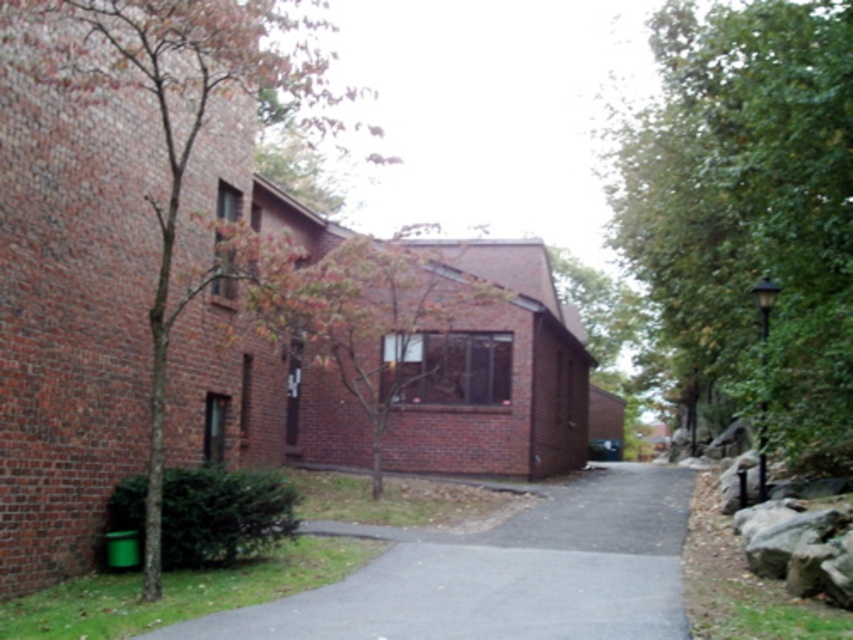
Question: Based on their relative distances, which object is nearer to the brown textured tree at left?

Choices:
 (A) green leafy tree at right
 (B) gray asphalt pavement at center

Answer: (B)

Question: Is green leafy tree at right positioned in front of brown textured tree at left?

Choices:
 (A) no
 (B) yes

Answer: (A)

Question: Which object is closer to the camera taking this photo?

Choices:
 (A) brown textured tree at left
 (B) green leafy tree at right
 (C) gray asphalt pavement at center

Answer: (C)

Question: Which object is positioned closest to the gray asphalt pavement at center?

Choices:
 (A) green leafy tree at right
 (B) brown textured tree at left

Answer: (A)

Question: Is green leafy tree at right above gray asphalt pavement at center?

Choices:
 (A) yes
 (B) no

Answer: (A)

Question: Does gray asphalt pavement at center appear on the left side of brown textured tree at left?

Choices:
 (A) no
 (B) yes

Answer: (A)